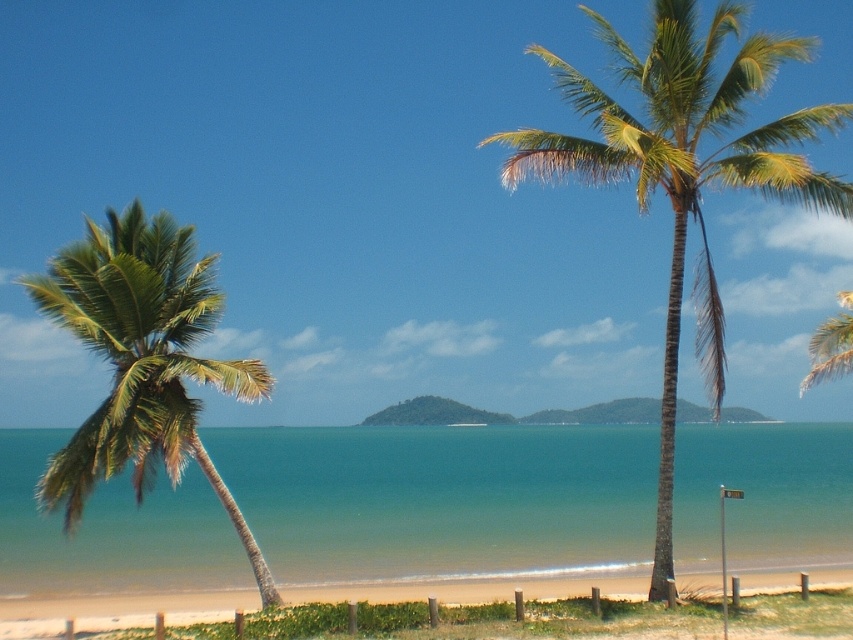
Question: Is green water at center to the left of green leafy palm tree at center from the viewer's perspective?

Choices:
 (A) no
 (B) yes

Answer: (B)

Question: Is green leafy palm tree at center below green leafy palm tree at left?

Choices:
 (A) yes
 (B) no

Answer: (B)

Question: Which point is closer to the camera taking this photo?

Choices:
 (A) (785, 125)
 (B) (149, 320)
 (C) (843, 374)
 (D) (531, 497)

Answer: (B)

Question: Which object is farther from the camera taking this photo?

Choices:
 (A) green water at center
 (B) green leafy palm tree at upper right
 (C) green leafy palm tree at left

Answer: (A)

Question: Does green water at center appear on the left side of green leafy palm tree at upper right?

Choices:
 (A) no
 (B) yes

Answer: (B)

Question: Based on their relative distances, which object is farther from the green leafy palm tree at upper right?

Choices:
 (A) green water at center
 (B) green leafy palm tree at left
 (C) green leafy palm tree at center

Answer: (B)